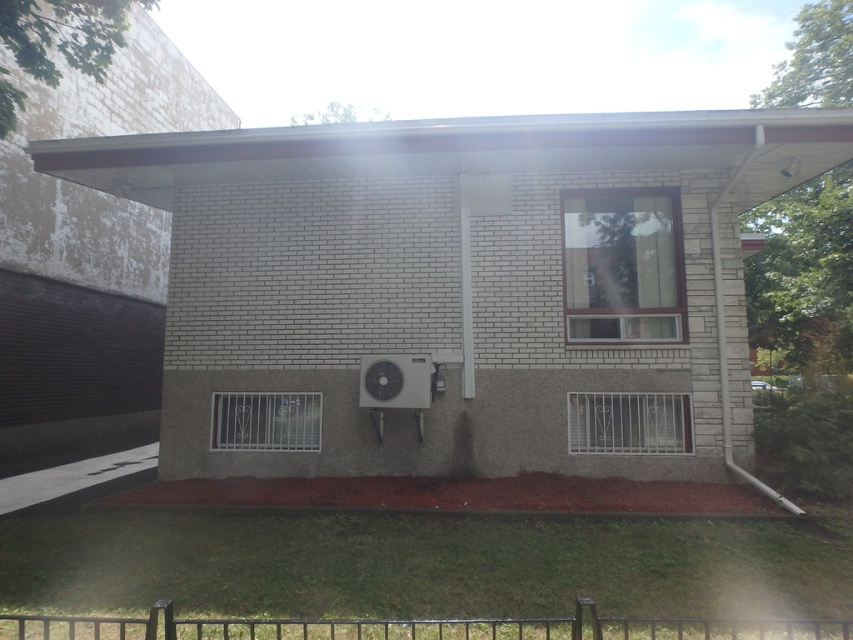
Is metallic silver window at lower center smaller than silver metallic air conditioner at center?

No.

Does metallic silver window at lower center have a greater height compared to silver metallic air conditioner at center?

Correct, metallic silver window at lower center is much taller as silver metallic air conditioner at center.

Image resolution: width=853 pixels, height=640 pixels. Describe the element at coordinates (630, 422) in the screenshot. I see `metallic silver window at lower center` at that location.

The height and width of the screenshot is (640, 853). In order to click on metallic silver window at lower center in this screenshot , I will do `click(630, 422)`.

The width and height of the screenshot is (853, 640). Find the location of `clear glass window at center`. clear glass window at center is located at coordinates (622, 266).

Does clear glass window at center have a larger size compared to metallic silver window at lower left?

Indeed, clear glass window at center has a larger size compared to metallic silver window at lower left.

Find the location of `clear glass window at center`. clear glass window at center is located at coordinates (622, 266).

Who is more forward, (625, 400) or (291, 432)?

Point (625, 400)

What are the coordinates of `metallic silver window at lower center` in the screenshot? It's located at (630, 422).

Is point (666, 401) positioned after point (215, 401)?

That is False.

Find the location of a particular element. Image resolution: width=853 pixels, height=640 pixels. metallic silver window at lower center is located at coordinates (630, 422).